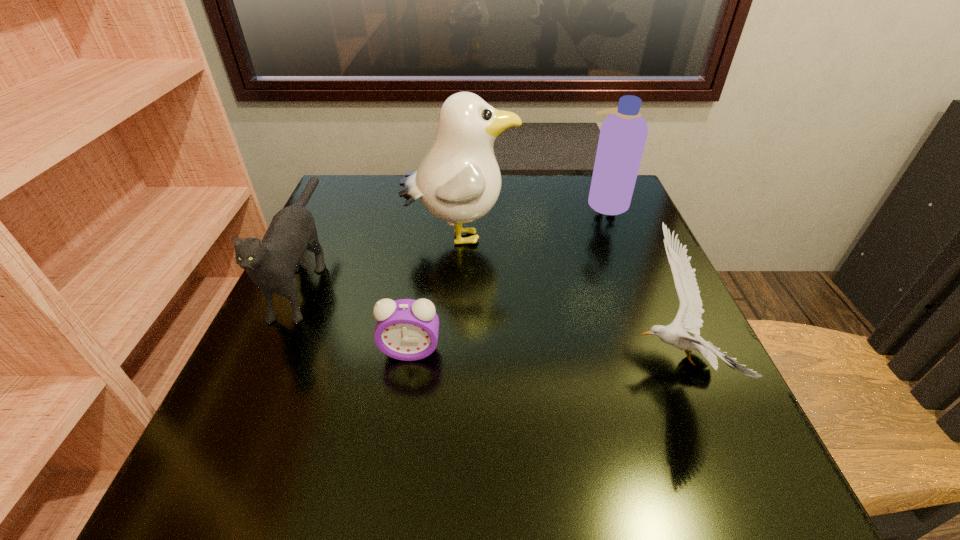
Find the location of `free spot between the shortest object and the right gull`. free spot between the shortest object and the right gull is located at coordinates 542,356.

Where is `vacant area that lies between the shampoo and the right gull`? The image size is (960, 540). vacant area that lies between the shampoo and the right gull is located at coordinates (639, 282).

Where is `free spot between the alarm clock and the fourth shortest object`? free spot between the alarm clock and the fourth shortest object is located at coordinates (509, 277).

You are a GUI agent. You are given a task and a screenshot of the screen. Output one action in this format:
    pyautogui.click(x=<x>, y=<y>)
    Task: Click on the unoccupied position between the leftmost object and the alarm clock
    The image size is (960, 540).
    Given the screenshot: What is the action you would take?
    pyautogui.click(x=358, y=312)

Find the location of a particular element. free spot between the nearer gull and the shortest object is located at coordinates (542, 356).

This screenshot has width=960, height=540. Find the location of `empty location between the fourth shortest object and the cat`. empty location between the fourth shortest object and the cat is located at coordinates (456, 238).

What are the coordinates of `vacant area between the leftmost object and the shortest object` in the screenshot? It's located at (358, 312).

Where is `free space between the right gull and the taller gull`? The height and width of the screenshot is (540, 960). free space between the right gull and the taller gull is located at coordinates (566, 299).

Locate an element on the screen. object that stands as the third closest to the shampoo is located at coordinates (406, 329).

Select which object appears as the closest to the alarm clock. Please provide its 2D coordinates. Your answer should be formatted as a tuple, i.e. [(x, y)], where the tuple contains the x and y coordinates of a point satisfying the conditions above.

[(271, 264)]